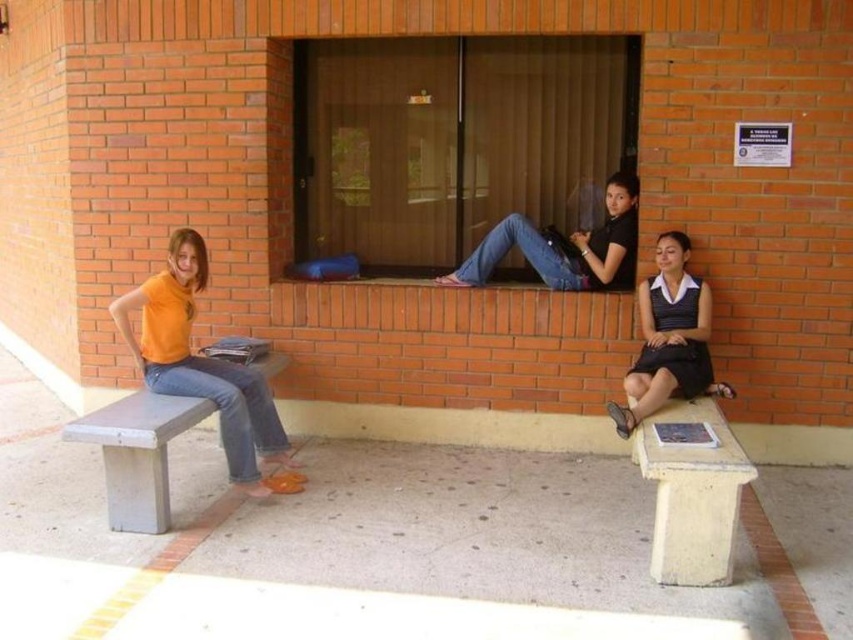
Based on the photo, you are standing in front of the building and notice the matte glass window at center and the orange matte shirt at left. Which object is positioned to the right of the other?

The matte glass window at center is to the right of the orange matte shirt at left.

Based on the photo, you are a photographer setting up a shoot in this scene. You need to position a backdrop that can cover both the orange matte shirt at left and the matte black dress at lower right without overlapping any other objects. Based on their positions, is the backdrop wide enough if it is 1.2 meters wide?

The orange matte shirt at left might be wider than matte black dress at lower right. Therefore, the 1.2 meter wide backdrop may not be sufficient to cover both without overlapping other objects, as the shirt could require more width.